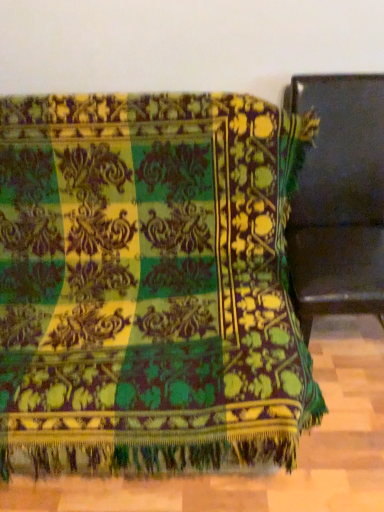
Question: From the image's perspective, is matte black chair at right, which is counted as the 2th furniture, starting from the left, under velvet green blanket at center, the second furniture positioned from the right?

Choices:
 (A) yes
 (B) no

Answer: (B)

Question: Does matte black chair at right, the 1th furniture positioned from the right, have a greater width compared to velvet green blanket at center, the first furniture when ordered from left to right?

Choices:
 (A) yes
 (B) no

Answer: (B)

Question: Is matte black chair at right, which is counted as the 2th furniture, starting from the left, positioned far away from velvet green blanket at center, the first furniture when ordered from left to right?

Choices:
 (A) yes
 (B) no

Answer: (B)

Question: Does matte black chair at right, the 1th furniture positioned from the right, lie in front of velvet green blanket at center, the first furniture when ordered from left to right?

Choices:
 (A) no
 (B) yes

Answer: (A)

Question: Is matte black chair at right, the 1th furniture positioned from the right, bigger than velvet green blanket at center, the second furniture positioned from the right?

Choices:
 (A) no
 (B) yes

Answer: (A)

Question: Does matte black chair at right, the 1th furniture positioned from the right, have a smaller size compared to velvet green blanket at center, the second furniture positioned from the right?

Choices:
 (A) yes
 (B) no

Answer: (A)

Question: Is velvet green blanket at center, the first furniture when ordered from left to right, looking in the opposite direction of matte black chair at right, the 1th furniture positioned from the right?

Choices:
 (A) no
 (B) yes

Answer: (A)

Question: From the image's perspective, is velvet green blanket at center, the first furniture when ordered from left to right, below matte black chair at right, the 1th furniture positioned from the right?

Choices:
 (A) yes
 (B) no

Answer: (A)

Question: Considering the relative sizes of velvet green blanket at center, the first furniture when ordered from left to right, and matte black chair at right, which is counted as the 2th furniture, starting from the left, in the image provided, is velvet green blanket at center, the first furniture when ordered from left to right, taller than matte black chair at right, which is counted as the 2th furniture, starting from the left,?

Choices:
 (A) no
 (B) yes

Answer: (A)

Question: Considering the relative sizes of velvet green blanket at center, the first furniture when ordered from left to right, and matte black chair at right, which is counted as the 2th furniture, starting from the left, in the image provided, is velvet green blanket at center, the first furniture when ordered from left to right, shorter than matte black chair at right, which is counted as the 2th furniture, starting from the left,?

Choices:
 (A) no
 (B) yes

Answer: (B)

Question: From a real-world perspective, is velvet green blanket at center, the first furniture when ordered from left to right, below matte black chair at right, which is counted as the 2th furniture, starting from the left?

Choices:
 (A) no
 (B) yes

Answer: (B)

Question: Is velvet green blanket at center, the second furniture positioned from the right, not close to matte black chair at right, which is counted as the 2th furniture, starting from the left?

Choices:
 (A) no
 (B) yes

Answer: (A)

Question: Do you think matte black chair at right, which is counted as the 2th furniture, starting from the left, is within velvet green blanket at center, the first furniture when ordered from left to right, or outside of it?

Choices:
 (A) inside
 (B) outside

Answer: (B)